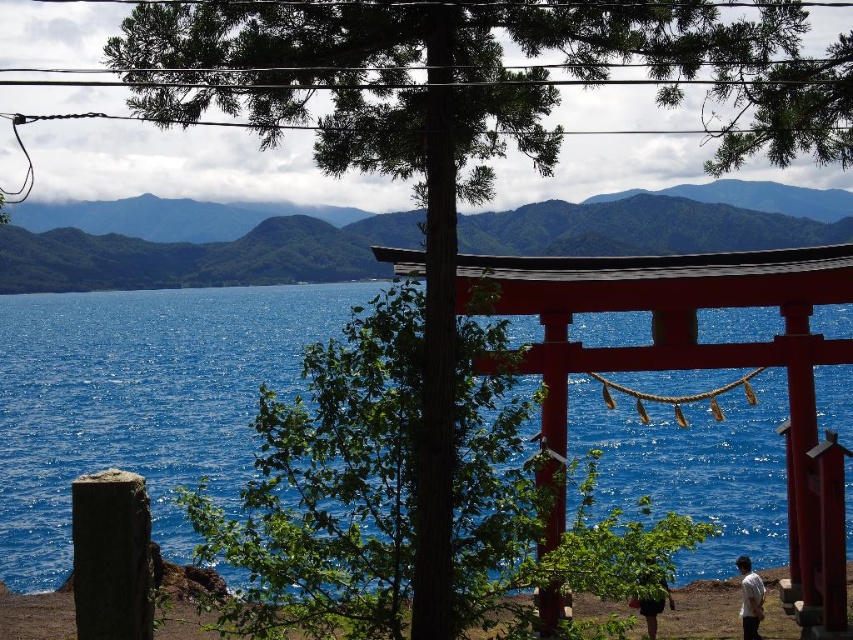
You are standing in the scene and want to walk from the green leafy hair at lower center to the blue liquid water at center. Which direction should you move?

To reach the blue liquid water at center from the green leafy hair at lower center, you should move to the right since the blue liquid water at center is located to the right of the green leafy hair at lower center.

Based on the photo, you are standing in the serene landscape scene and notice a white cotton shirt at lower right and a green leafy hair at lower center. Which object is shorter in height?

The white cotton shirt at lower right is not as tall as the green leafy hair at lower center, so the white cotton shirt at lower right is shorter in height.